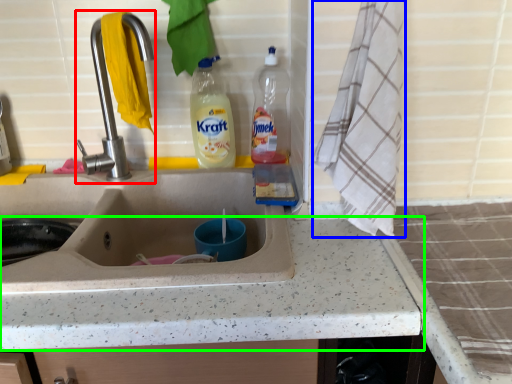
Question: Based on their relative distances, which object is nearer to tap (highlighted by a red box)? Choose from bath towel (highlighted by a blue box) and countertop (highlighted by a green box).

Choices:
 (A) bath towel
 (B) countertop

Answer: (A)